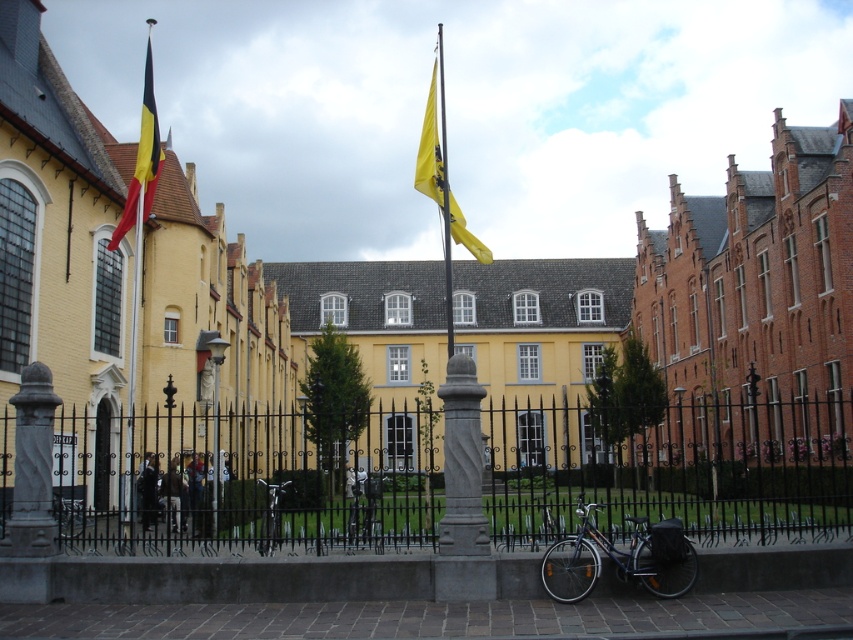
Question: Which of the following is the farthest from the observer?

Choices:
 (A) (265, 531)
 (B) (149, 202)

Answer: (B)

Question: Among these objects, which one is farthest from the camera?

Choices:
 (A) black wrought iron fence at center
 (B) shiny blue bicycle at lower right

Answer: (A)

Question: Can you confirm if yellow fabric flagpole at center is smaller than silver metallic bicycle at center?

Choices:
 (A) yes
 (B) no

Answer: (B)

Question: Is shiny blue bicycle at lower right to the left of matte black flag at left from the viewer's perspective?

Choices:
 (A) yes
 (B) no

Answer: (B)

Question: Is matte black flag at left in front of yellow fabric flagpole at center?

Choices:
 (A) no
 (B) yes

Answer: (B)

Question: Among these objects, which one is farthest from the camera?

Choices:
 (A) silver metallic bicycle at center
 (B) shiny metallic bicycle at center
 (C) matte black flag at left

Answer: (C)